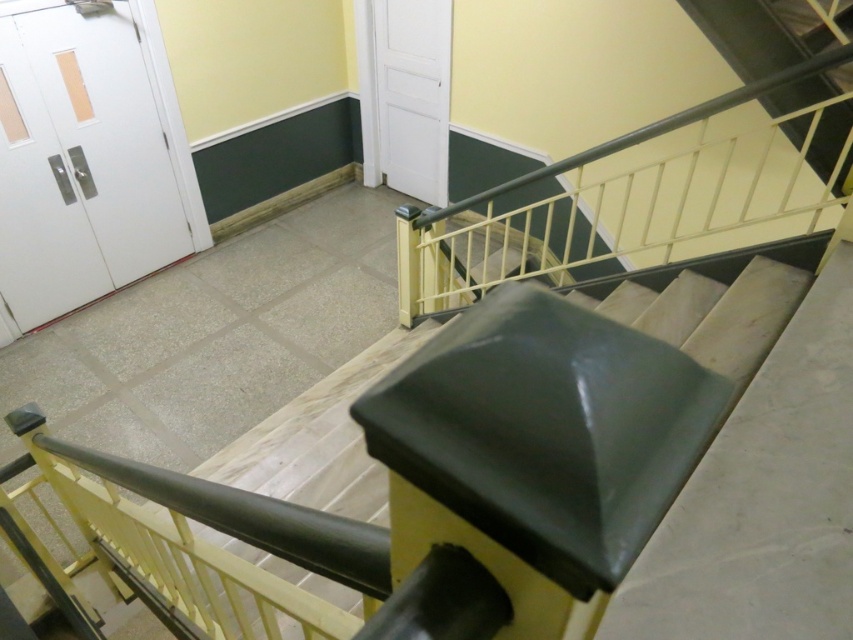
Question: Is white matte door at left to the right of white matte door at upper center from the viewer's perspective?

Choices:
 (A) no
 (B) yes

Answer: (A)

Question: Is white matte door at left closer to camera compared to white matte door at upper center?

Choices:
 (A) no
 (B) yes

Answer: (B)

Question: Which object appears closest to the camera in this image?

Choices:
 (A) white matte door at upper center
 (B) white matte door at left

Answer: (B)

Question: Observing the image, what is the correct spatial positioning of white matte door at left in reference to white matte door at upper center?

Choices:
 (A) left
 (B) right

Answer: (A)